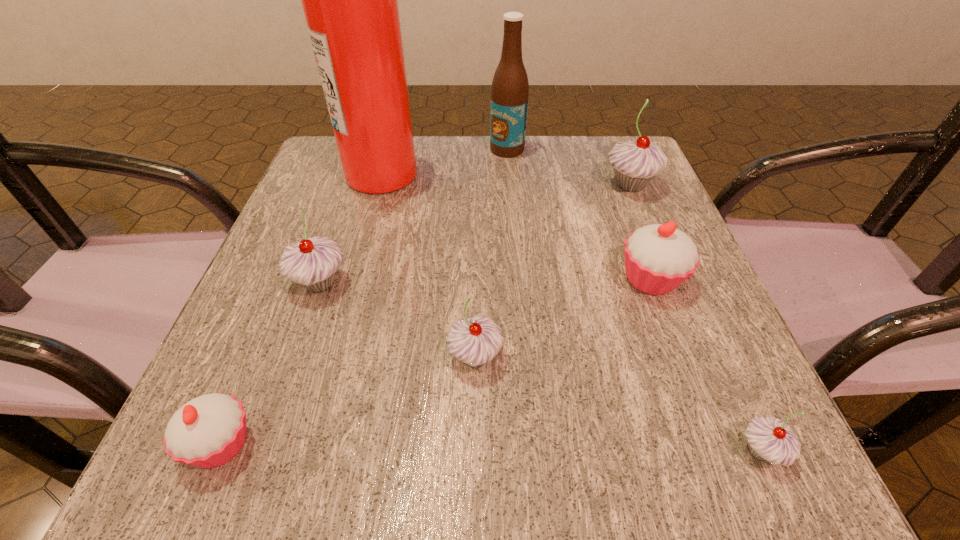
Choose which gray cupcake is the third nearest neighbor to the farthest cupcake. Please provide its 2D coordinates. Your answer should be formatted as a tuple, i.e. [(x, y)], where the tuple contains the x and y coordinates of a point satisfying the conditions above.

[(313, 263)]

I want to click on vacant space that satisfies the following two spatial constraints: 1. at the nozzle of the tallest object; 2. on the right side of the nearest gray cupcake, so click(305, 451).

At what (x,y) coordinates should I click in order to perform the action: click on free space that satisfies the following two spatial constraints: 1. at the nozzle of the bigger pink cupcake; 2. on the left side of the fire extinguisher. Please return your answer as a coordinate pair (x, y). Looking at the image, I should click on (352, 279).

Where is `vacant position in the image that satisfies the following two spatial constraints: 1. at the nozzle of the tallest object; 2. on the left side of the bigger pink cupcake`? The image size is (960, 540). vacant position in the image that satisfies the following two spatial constraints: 1. at the nozzle of the tallest object; 2. on the left side of the bigger pink cupcake is located at coordinates (352, 279).

Locate an element on the screen. This screenshot has width=960, height=540. blank space that satisfies the following two spatial constraints: 1. at the nozzle of the sixth shortest object; 2. on the left side of the fire extinguisher is located at coordinates (379, 185).

The image size is (960, 540). What are the coordinates of `vacant region that satisfies the following two spatial constraints: 1. at the nozzle of the tallest object; 2. on the right side of the third nearest object` in the screenshot? It's located at (331, 357).

Where is `blank space that satisfies the following two spatial constraints: 1. at the nozzle of the fire extinguisher; 2. on the back side of the tallest cupcake`? The width and height of the screenshot is (960, 540). blank space that satisfies the following two spatial constraints: 1. at the nozzle of the fire extinguisher; 2. on the back side of the tallest cupcake is located at coordinates (379, 185).

Locate an element on the screen. The width and height of the screenshot is (960, 540). free space that satisfies the following two spatial constraints: 1. on the back side of the third gray cupcake from right to left; 2. on the right side of the nearer pink cupcake is located at coordinates (257, 357).

At what (x,y) coordinates should I click in order to perform the action: click on free spot that satisfies the following two spatial constraints: 1. on the back side of the seventh shortest object; 2. on the right side of the nearer pink cupcake. Please return your answer as a coordinate pair (x, y). Image resolution: width=960 pixels, height=540 pixels. Looking at the image, I should click on (344, 149).

Locate an element on the screen. This screenshot has width=960, height=540. vacant space that satisfies the following two spatial constraints: 1. on the front side of the smallest gray cupcake; 2. on the left side of the smaller pink cupcake is located at coordinates (219, 451).